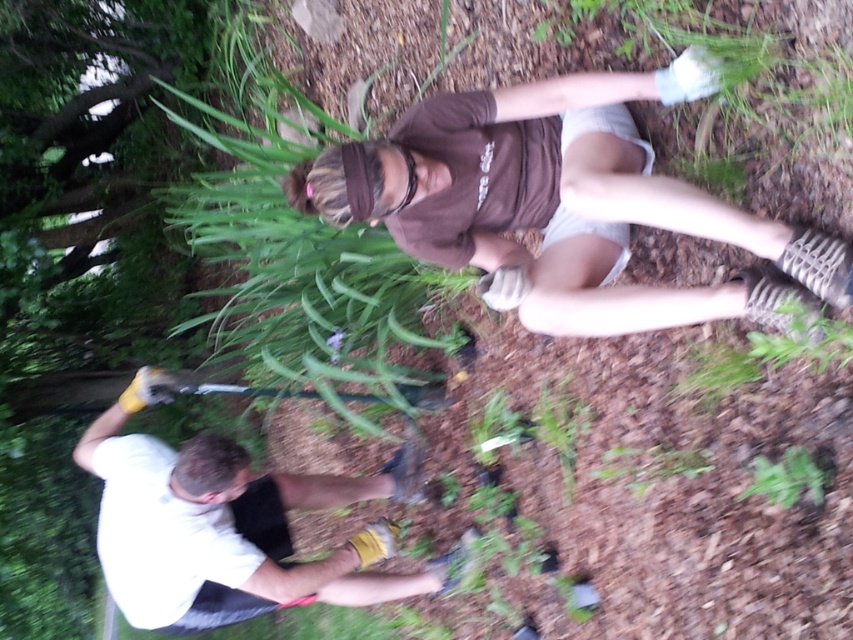
Who is lower down, brown cotton shirt at upper center or green leafy plant at lower right?

green leafy plant at lower right is lower down.

Is brown cotton shirt at upper center bigger than green leafy plant at lower right?

Yes.

Which is in front, point (604, 243) or point (756, 477)?

Point (756, 477)

The width and height of the screenshot is (853, 640). In order to click on brown cotton shirt at upper center in this screenshot , I will do `click(560, 204)`.

Consider the image. Does white matte shirt at lower left have a lesser width compared to green leafy plant at lower right?

No.

Is point (279, 586) positioned behind point (772, 480)?

Yes.

At what (x,y) coordinates should I click in order to perform the action: click on white matte shirt at lower left. Please return your answer as a coordinate pair (x, y). The height and width of the screenshot is (640, 853). Looking at the image, I should click on (225, 524).

Where is `brown cotton shirt at upper center`? The height and width of the screenshot is (640, 853). brown cotton shirt at upper center is located at coordinates (560, 204).

Is brown cotton shirt at upper center smaller than white matte shirt at lower left?

Indeed, brown cotton shirt at upper center has a smaller size compared to white matte shirt at lower left.

Who is more distant from viewer, (474, 216) or (227, 506)?

Positioned behind is point (227, 506).

Where is `brown cotton shirt at upper center`? The height and width of the screenshot is (640, 853). brown cotton shirt at upper center is located at coordinates (560, 204).